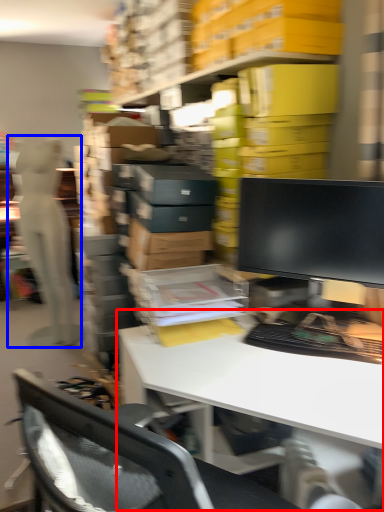
Question: Among these objects, which one is farthest to the camera, desk (highlighted by a red box) or person (highlighted by a blue box)?

Choices:
 (A) desk
 (B) person

Answer: (B)